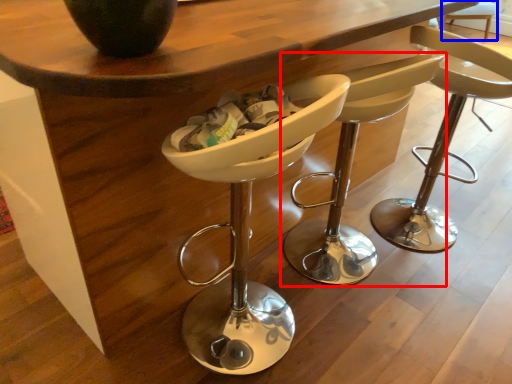
Question: Among these objects, which one is nearest to the camera, chair (highlighted by a red box) or bar stool (highlighted by a blue box)?

Choices:
 (A) chair
 (B) bar stool

Answer: (A)